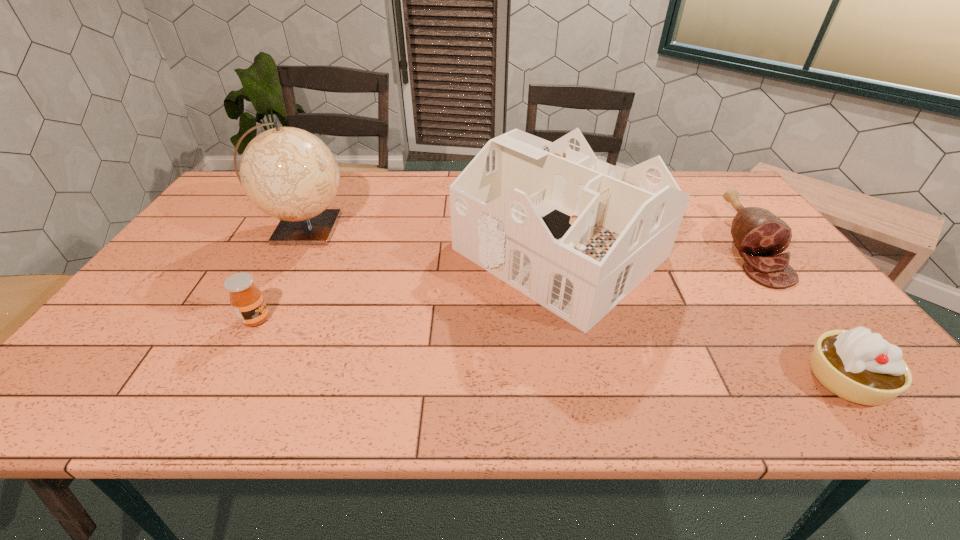
You are a GUI agent. You are given a task and a screenshot of the screen. Output one action in this format:
    pyautogui.click(x=<x>, y=<y>)
    Task: Click on the blank area located 0.090m on the back of the whipped cream
    The width and height of the screenshot is (960, 540).
    Given the screenshot: What is the action you would take?
    (x=802, y=321)

Locate an element on the screen. The image size is (960, 540). globe present at the far edge is located at coordinates (288, 173).

This screenshot has height=540, width=960. I want to click on dollhouse positioned at the far edge, so click(575, 234).

This screenshot has width=960, height=540. I want to click on object located at the near edge, so click(x=858, y=366).

Locate an element on the screen. Image resolution: width=960 pixels, height=540 pixels. ham at the right edge is located at coordinates (759, 235).

Where is `whipped cream situated at the right edge`? whipped cream situated at the right edge is located at coordinates click(858, 366).

Identify the location of object situated at the near right corner. Image resolution: width=960 pixels, height=540 pixels. (858, 366).

The image size is (960, 540). I want to click on blank space at the far edge, so click(x=445, y=190).

At what (x,y) coordinates should I click in order to perform the action: click on blank space at the near edge of the desktop. Please return your answer as a coordinate pair (x, y). The width and height of the screenshot is (960, 540). Looking at the image, I should click on (757, 402).

The width and height of the screenshot is (960, 540). I want to click on vacant area at the left edge of the desktop, so click(x=176, y=287).